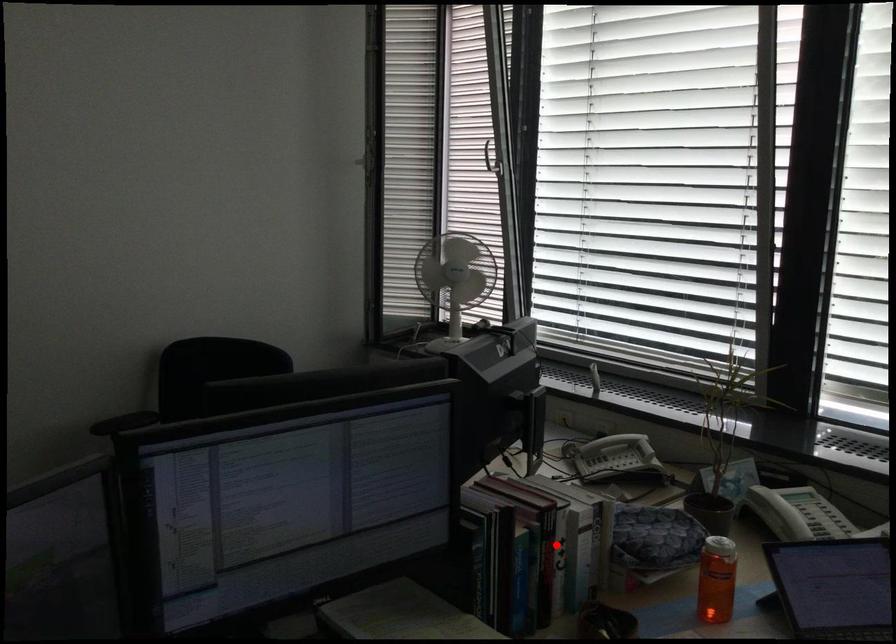
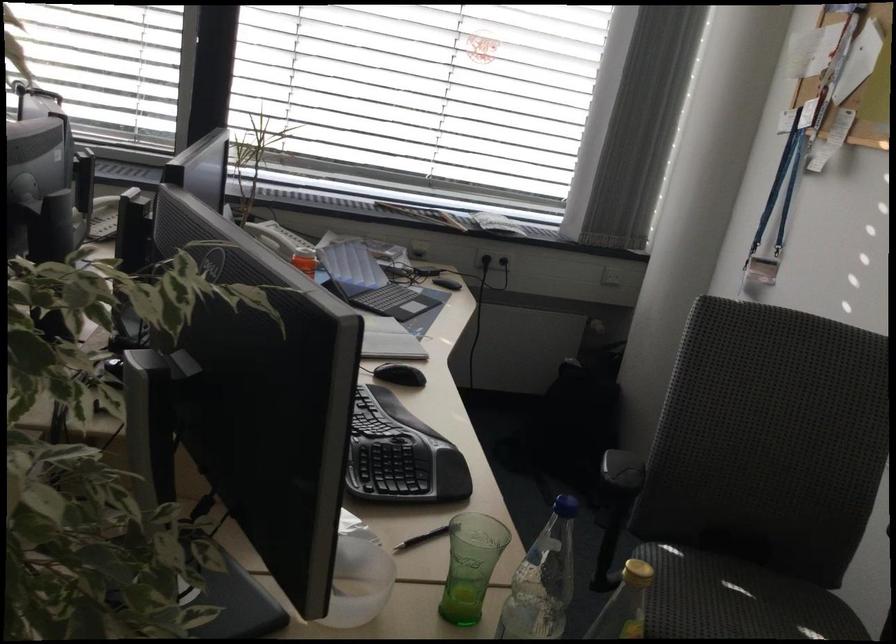
Question: I am providing you with two images of the same scene from different viewpoints. A red point is marked on the first image. Can you still see the location of the red point in image 2?

Choices:
 (A) Yes
 (B) No

Answer: (B)